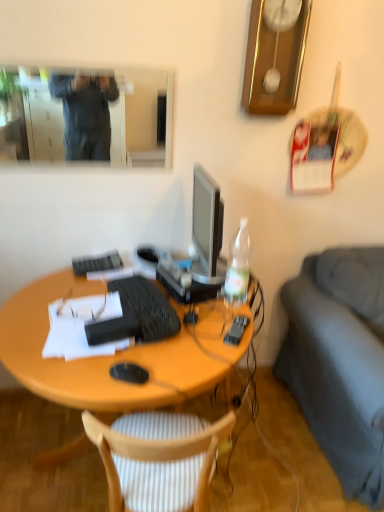
This screenshot has width=384, height=512. Identify the location of free space between black matte computer mouse at center and black plastic remote control at right. (187, 351).